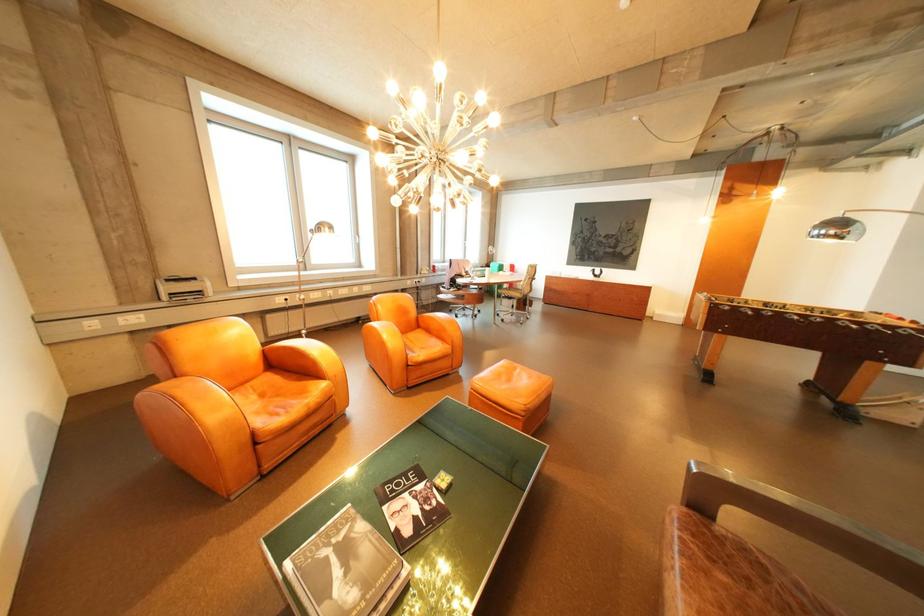
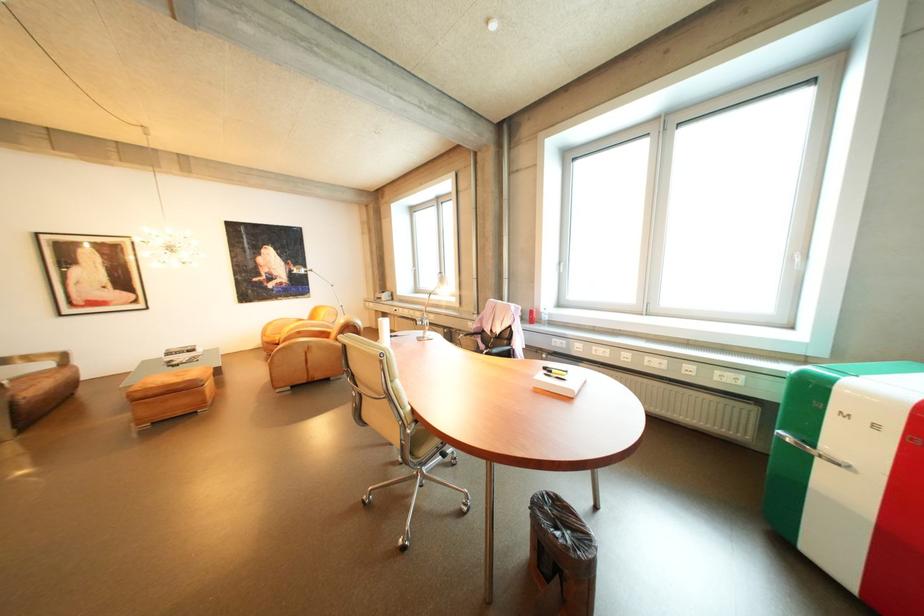
Question: I am providing you with two images of the same scene from different viewpoints. After the viewpoint changes to image2, which objects are now occluded?

Choices:
 (A) white office printer
 (B) blue book box
 (C) black marker
 (D) small trash can

Answer: (A)